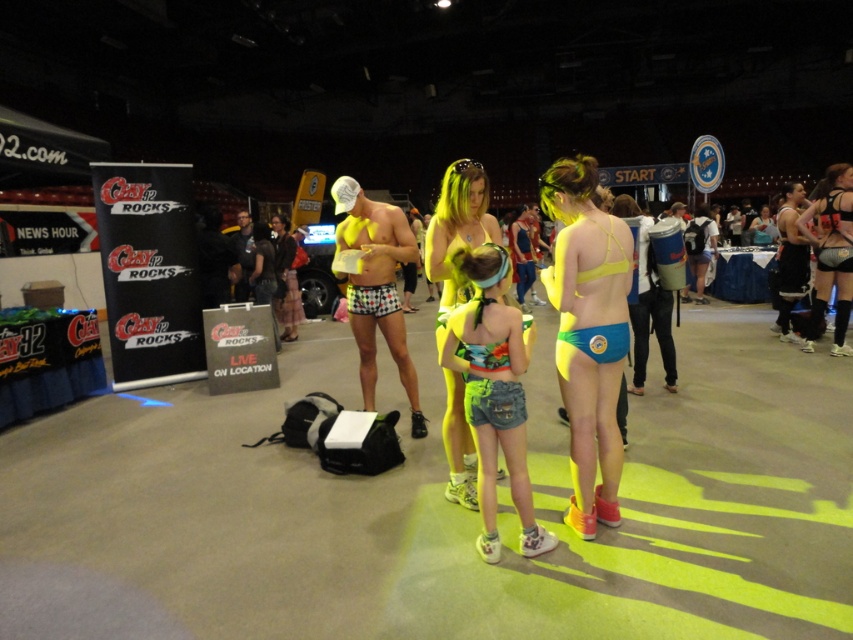
Question: Observing the image, what is the correct spatial positioning of denim shorts at center in reference to neon yellow bikini at center?

Choices:
 (A) left
 (B) right

Answer: (B)

Question: Which of the following is the farthest from the observer?

Choices:
 (A) (404, 339)
 (B) (550, 179)
 (C) (485, 292)
 (D) (450, 474)

Answer: (A)

Question: Among these points, which one is farthest from the camera?

Choices:
 (A) (544, 289)
 (B) (465, 470)
 (C) (833, 188)
 (D) (509, 372)

Answer: (C)

Question: Does neon yellow bikini at center lie in front of neon yellow bikini at right?

Choices:
 (A) yes
 (B) no

Answer: (A)

Question: In this image, where is neon yellow bikini top at center located relative to neon yellow bikini at right?

Choices:
 (A) left
 (B) right

Answer: (A)

Question: Which point appears farthest from the camera in this image?

Choices:
 (A) (500, 429)
 (B) (422, 429)

Answer: (B)